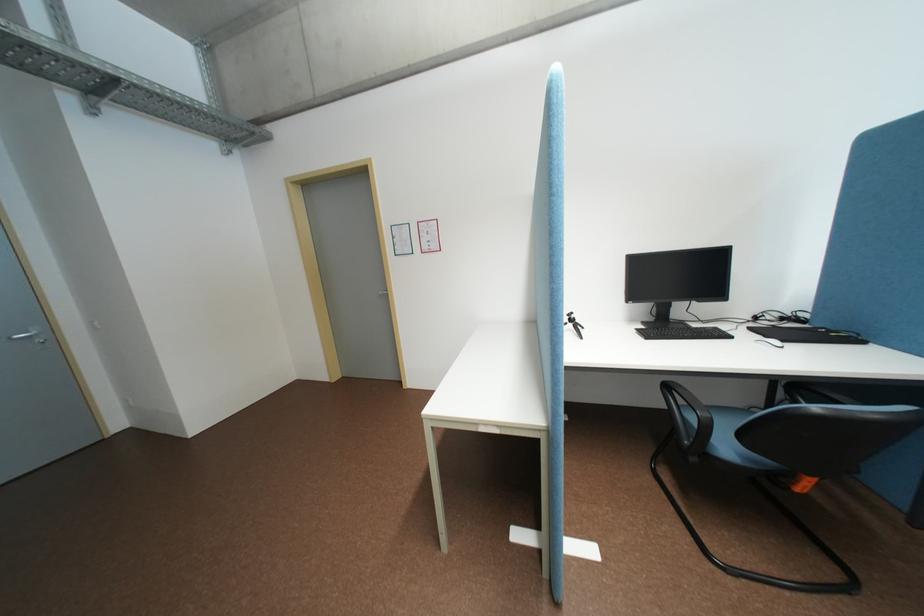
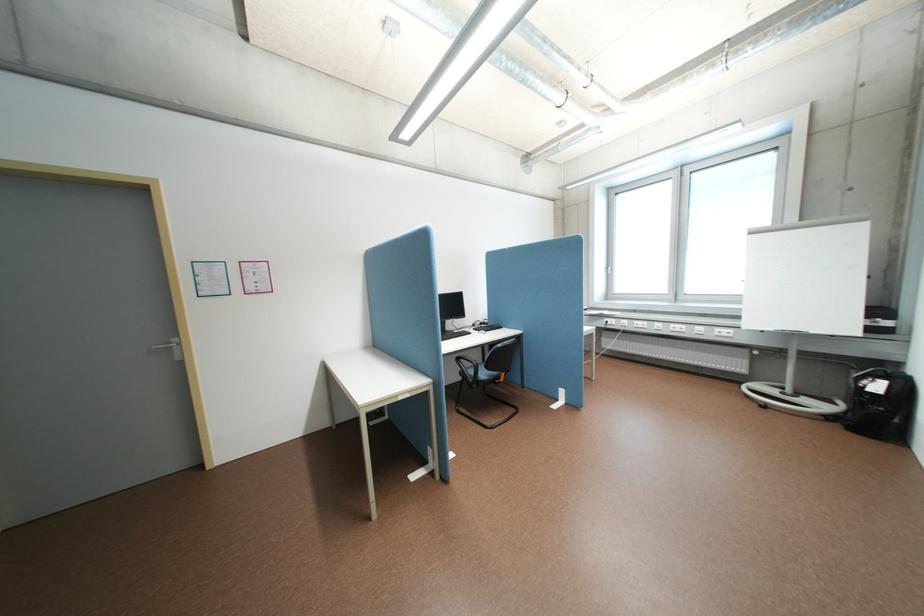
Find the pixel in the second image that matches pixel 487 423 in the first image.

(407, 395)